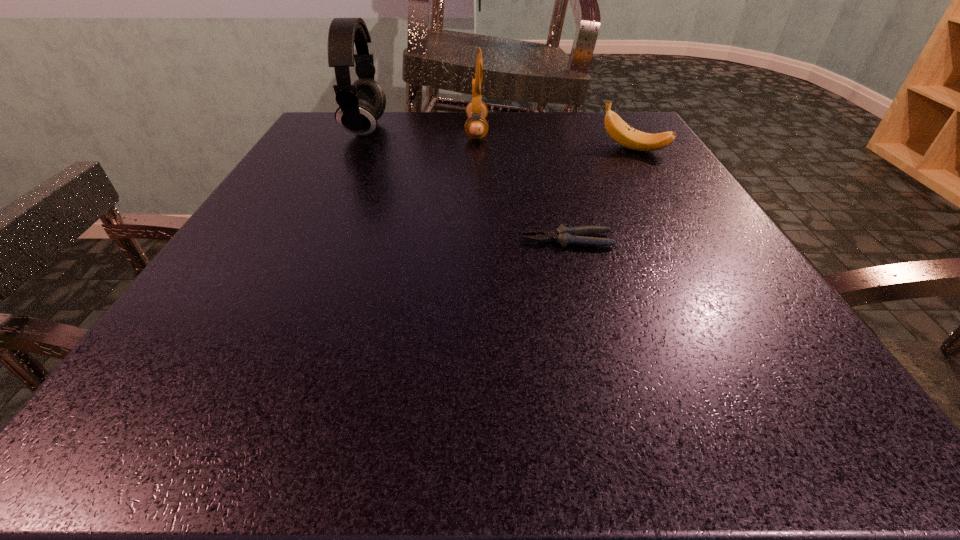
I want to click on vacant space located on the left of the second shortest object, so click(x=487, y=149).

Where is `free location located 0.190m at the gripping part of the third object from left to right`? free location located 0.190m at the gripping part of the third object from left to right is located at coordinates (404, 240).

Where is `vacant area situated 0.380m at the gripping part of the third object from left to right`? Image resolution: width=960 pixels, height=540 pixels. vacant area situated 0.380m at the gripping part of the third object from left to right is located at coordinates (285, 240).

The height and width of the screenshot is (540, 960). Identify the location of free space located 0.160m at the gripping part of the third object from left to right. (422, 240).

I want to click on banana situated at the far edge, so click(622, 133).

This screenshot has width=960, height=540. I want to click on object that is at the left edge, so click(361, 104).

Locate an element on the screen. object at the right edge is located at coordinates (622, 133).

Identify the location of object present at the far left corner. The image size is (960, 540). (361, 104).

Identify the location of object that is positioned at the far right corner. (622, 133).

What are the coordinates of `vacant space at the far edge of the desktop` in the screenshot? It's located at (529, 119).